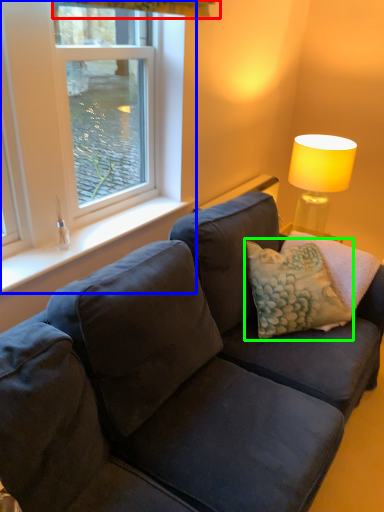
Question: Considering the real-world distances, which object is farthest from curtain (highlighted by a red box)? window (highlighted by a blue box) or pillow (highlighted by a green box)?

Choices:
 (A) window
 (B) pillow

Answer: (B)